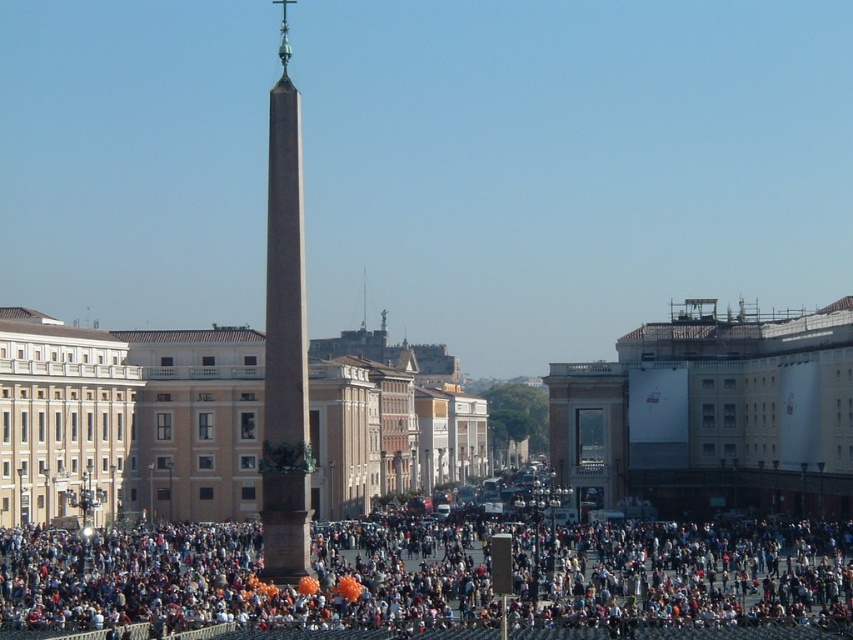
Question: Among these objects, which one is nearest to the camera?

Choices:
 (A) multicolored fabric crowd at lower center
 (B) brown polished stone obelisk at center

Answer: (A)

Question: Is multicolored fabric crowd at lower center to the right of brown polished stone obelisk at center from the viewer's perspective?

Choices:
 (A) no
 (B) yes

Answer: (B)

Question: Which point appears closest to the camera in this image?

Choices:
 (A) (364, 321)
 (B) (279, 605)
 (C) (293, 160)

Answer: (B)

Question: Is multicolored fabric crowd at lower center below brown polished stone obelisk at center?

Choices:
 (A) yes
 (B) no

Answer: (A)

Question: Does multicolored fabric crowd at lower center appear under smooth stone spire at center?

Choices:
 (A) yes
 (B) no

Answer: (A)

Question: Which of the following is the closest to the observer?

Choices:
 (A) (282, 77)
 (B) (364, 305)

Answer: (A)